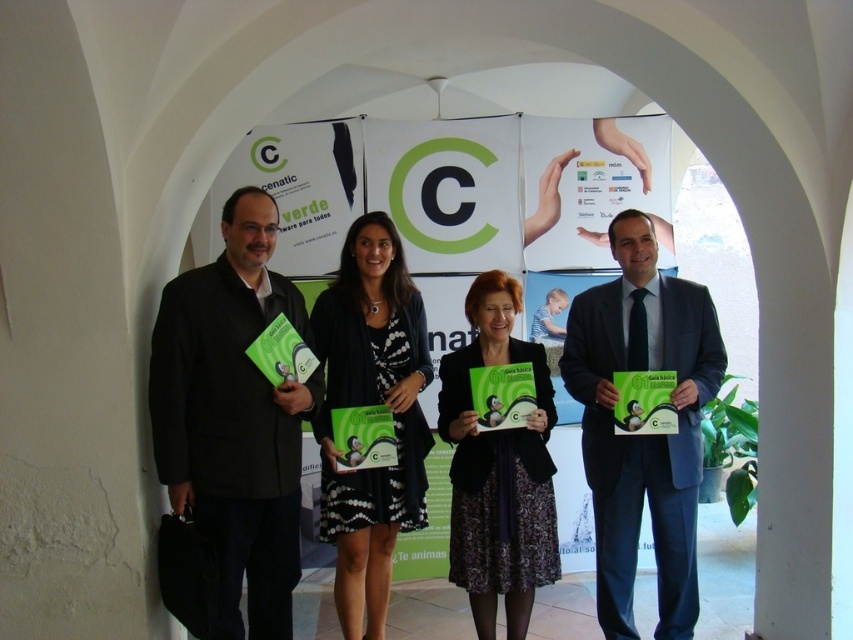
Based on the scene description, where is the matte black suit at center located in terms of coordinates?

The matte black suit at center is located at point coordinates of (642, 435).

You are standing in the hallway and want to take a photo of both point (233,474) and point (381,259). Which point should you focus on first to ensure both are in focus?

You should focus on point (381,259) first because it is farther from the camera than point (233,474). By focusing on the farther point, the closer point will also be within the depth of field.

You are a photographer standing in front of the group. You need to take a photo of the matte black suit at left and the black dotted dress at center. How far apart are these two individuals?

The matte black suit at left is 15.83 inches from the black dotted dress at center, so the distance between them is 15.83 inches.